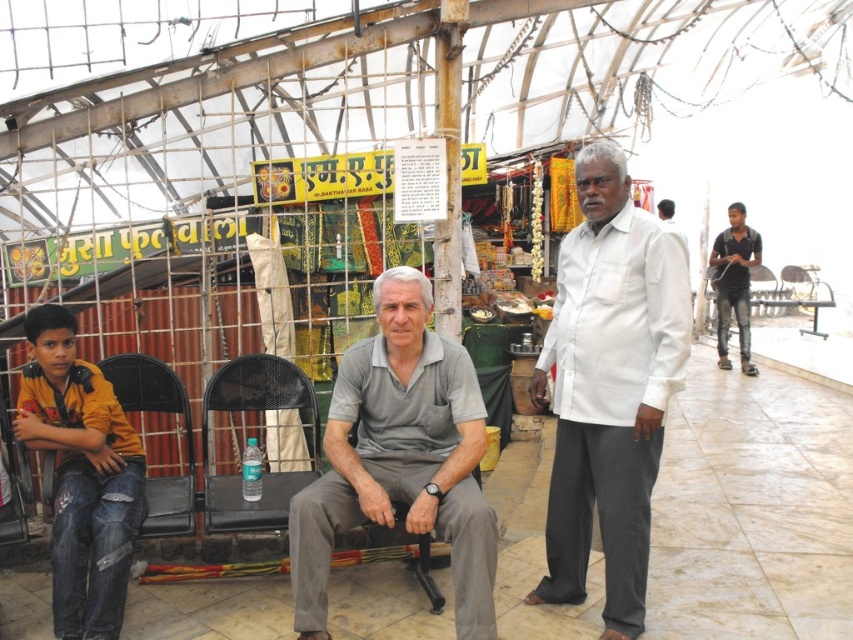
Does gray cotton shirt at center appear over black mesh chair at center?

Correct, gray cotton shirt at center is located above black mesh chair at center.

Between point (312, 593) and point (239, 387), which one is positioned behind?

Positioned behind is point (239, 387).

The height and width of the screenshot is (640, 853). Identify the location of gray cotton shirt at center. (399, 458).

Is point (646, 467) in front of point (236, 497)?

Yes, point (646, 467) is closer to viewer.

Is point (579, 582) positioned in front of point (206, 508)?

No, it is behind (206, 508).

At what (x,y) coordinates should I click in order to perform the action: click on white cotton shirt at center. Please return your answer as a coordinate pair (x, y). This screenshot has width=853, height=640. Looking at the image, I should click on (608, 387).

Who is higher up, jeans at left or black mesh chair at center?

Positioned higher is jeans at left.

Locate an element on the screen. The width and height of the screenshot is (853, 640). jeans at left is located at coordinates (80, 476).